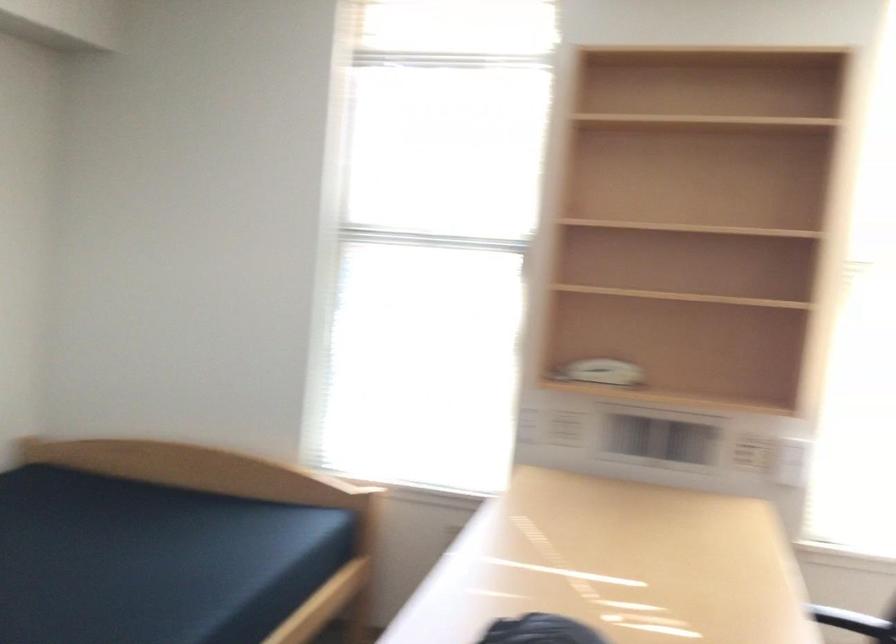
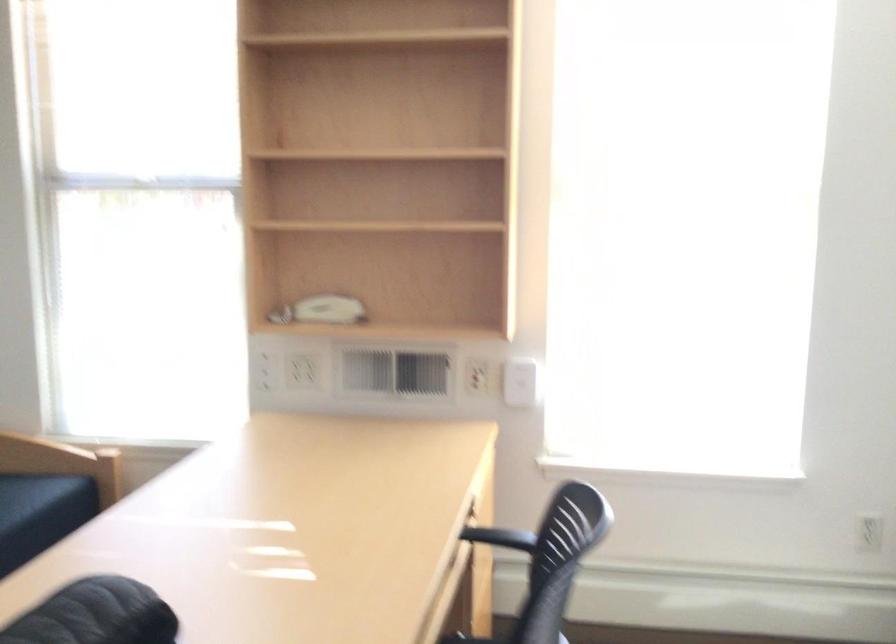
In the second image, find the point that corresponds to [599,377] in the first image.

(324, 314)